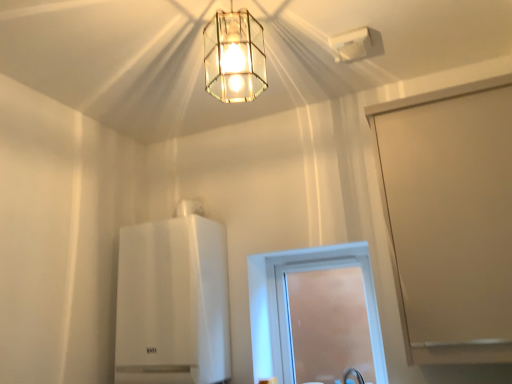
In order to face white glossy boiler at center, should I rotate leftwards or rightwards?

Turn left by 11.177 degrees to look at white glossy boiler at center.

Find the location of a particular element. The height and width of the screenshot is (384, 512). clear glass window at center is located at coordinates (287, 305).

This screenshot has height=384, width=512. What do you see at coordinates (287, 305) in the screenshot?
I see `clear glass window at center` at bounding box center [287, 305].

Identify the location of white glossy boiler at center. The height and width of the screenshot is (384, 512). (173, 303).

From the picture: Can you confirm if white glossy boiler at center is smaller than white plastic air vent at upper center, arranged as the 2th lamp when viewed from the left?

No, white glossy boiler at center is not smaller than white plastic air vent at upper center, arranged as the 2th lamp when viewed from the left.

In terms of width, does white glossy boiler at center look wider or thinner when compared to white plastic air vent at upper center, which is the first lamp from back to front?

Considering their sizes, white glossy boiler at center looks broader than white plastic air vent at upper center, which is the first lamp from back to front.

Is the surface of white glossy boiler at center in direct contact with white plastic air vent at upper center, which is the first lamp from back to front?

No, white glossy boiler at center is not in contact with white plastic air vent at upper center, which is the first lamp from back to front.

Does white glossy boiler at center contain white plastic air vent at upper center, placed as the 1th lamp when sorted from right to left?

No, white plastic air vent at upper center, placed as the 1th lamp when sorted from right to left, is not surrounded by white glossy boiler at center.

Considering the positions of objects beige matte screen door at right and clear glass pendant light at upper center, which is the 2th lamp in back-to-front order, in the image provided, who is behind, beige matte screen door at right or clear glass pendant light at upper center, which is the 2th lamp in back-to-front order,?

beige matte screen door at right is further away from the camera.

Is beige matte screen door at right positioned far away from clear glass pendant light at upper center, placed as the 2th lamp when sorted from right to left?

beige matte screen door at right is actually quite close to clear glass pendant light at upper center, placed as the 2th lamp when sorted from right to left.

Is beige matte screen door at right positioned beyond the bounds of clear glass pendant light at upper center, placed as the 2th lamp when sorted from right to left?

Yes.

From a real-world perspective, is beige matte screen door at right below clear glass pendant light at upper center, which is the first lamp in front-to-back order?

Yes, from a real-world perspective, beige matte screen door at right is beneath clear glass pendant light at upper center, which is the first lamp in front-to-back order.

Relative to clear glass pendant light at upper center, placed as the first lamp when sorted from left to right, is white glossy boiler at center in front or behind?

Clearly, white glossy boiler at center is behind clear glass pendant light at upper center, placed as the first lamp when sorted from left to right.

Considering the relative sizes of white glossy boiler at center and clear glass pendant light at upper center, which is the 2th lamp in back-to-front order, in the image provided, is white glossy boiler at center thinner than clear glass pendant light at upper center, which is the 2th lamp in back-to-front order,?

In fact, white glossy boiler at center might be wider than clear glass pendant light at upper center, which is the 2th lamp in back-to-front order.

Consider the image. Is clear glass pendant light at upper center, which is the first lamp in front-to-back order, located within white glossy boiler at center?

No, white glossy boiler at center does not contain clear glass pendant light at upper center, which is the first lamp in front-to-back order.

Is white glossy boiler at center positioned with its back to clear glass pendant light at upper center, which is the 2th lamp in back-to-front order?

No, white glossy boiler at center's orientation is not away from clear glass pendant light at upper center, which is the 2th lamp in back-to-front order.

How many degrees apart are the facing directions of clear glass pendant light at upper center, placed as the first lamp when sorted from left to right, and white plastic air vent at upper center, which is the first lamp from back to front?

The angular difference between clear glass pendant light at upper center, placed as the first lamp when sorted from left to right, and white plastic air vent at upper center, which is the first lamp from back to front, is 6.69 degrees.

Can you confirm if clear glass pendant light at upper center, placed as the 2th lamp when sorted from right to left, is positioned to the left of white plastic air vent at upper center, arranged as the 2th lamp when viewed from the left?

Indeed, clear glass pendant light at upper center, placed as the 2th lamp when sorted from right to left, is positioned on the left side of white plastic air vent at upper center, arranged as the 2th lamp when viewed from the left.

From the image's perspective, relative to white plastic air vent at upper center, which is the first lamp from back to front, is clear glass pendant light at upper center, placed as the first lamp when sorted from left to right, above or below?

Based on their image positions, clear glass pendant light at upper center, placed as the first lamp when sorted from left to right, is located beneath white plastic air vent at upper center, which is the first lamp from back to front.

Considering the sizes of objects clear glass pendant light at upper center, placed as the first lamp when sorted from left to right, and white plastic air vent at upper center, placed as the 1th lamp when sorted from right to left, in the image provided, who is smaller, clear glass pendant light at upper center, placed as the first lamp when sorted from left to right, or white plastic air vent at upper center, placed as the 1th lamp when sorted from right to left,?

Smaller between the two is white plastic air vent at upper center, placed as the 1th lamp when sorted from right to left.

In the scene shown: Does beige matte screen door at right come behind white plastic air vent at upper center, placed as the 1th lamp when sorted from right to left?

That is False.

Can you tell me how much beige matte screen door at right and white plastic air vent at upper center, which is the first lamp from back to front, differ in facing direction?

They differ by 1.06 degrees in their facing directions.

Is beige matte screen door at right with white plastic air vent at upper center, placed as the second lamp when sorted from front to back?

No, beige matte screen door at right is not with white plastic air vent at upper center, placed as the second lamp when sorted from front to back.

Is beige matte screen door at right thinner than white plastic air vent at upper center, which is the first lamp from back to front?

No, beige matte screen door at right is not thinner than white plastic air vent at upper center, which is the first lamp from back to front.

Is clear glass window at center looking in the opposite direction of white plastic air vent at upper center, arranged as the 2th lamp when viewed from the left?

clear glass window at center is not turned away from white plastic air vent at upper center, arranged as the 2th lamp when viewed from the left.

From a real-world perspective, who is located higher, clear glass window at center or white plastic air vent at upper center, arranged as the 2th lamp when viewed from the left?

white plastic air vent at upper center, arranged as the 2th lamp when viewed from the left, from a real-world perspective.

Is clear glass window at center in front of or behind white plastic air vent at upper center, placed as the 1th lamp when sorted from right to left, in the image?

In the image, clear glass window at center appears behind white plastic air vent at upper center, placed as the 1th lamp when sorted from right to left.

Is white plastic air vent at upper center, placed as the 1th lamp when sorted from right to left, completely or partially inside clear glass window at center?

No, white plastic air vent at upper center, placed as the 1th lamp when sorted from right to left, is not surrounded by clear glass window at center.

From the image's perspective, between white plastic air vent at upper center, arranged as the 2th lamp when viewed from the left, and white glossy boiler at center, which one is located above?

white plastic air vent at upper center, arranged as the 2th lamp when viewed from the left.

Consider the image. Are white plastic air vent at upper center, placed as the second lamp when sorted from front to back, and white glossy boiler at center far apart?

white plastic air vent at upper center, placed as the second lamp when sorted from front to back, is far away from white glossy boiler at center.

Is white plastic air vent at upper center, placed as the second lamp when sorted from front to back, positioned behind white glossy boiler at center?

No, white plastic air vent at upper center, placed as the second lamp when sorted from front to back, is closer to the camera.

Looking at their sizes, would you say white plastic air vent at upper center, arranged as the 2th lamp when viewed from the left, is wider or thinner than white glossy boiler at center?

white plastic air vent at upper center, arranged as the 2th lamp when viewed from the left, is thinner than white glossy boiler at center.

This screenshot has height=384, width=512. What are the coordinates of `appliance to the left of white plastic air vent at upper center, placed as the second lamp when sorted from front to back` in the screenshot? It's located at tap(173, 303).

You are a GUI agent. You are given a task and a screenshot of the screen. Output one action in this format:
    pyautogui.click(x=<x>, y=<y>)
    Task: Click on the screen door below the clear glass pendant light at upper center, which is the 2th lamp in back-to-front order (from a real-world perspective)
    
    Given the screenshot: What is the action you would take?
    pyautogui.click(x=450, y=218)

Which object lies nearer to the anchor point clear glass window at center, clear glass pendant light at upper center, which is the first lamp in front-to-back order, or white plastic air vent at upper center, placed as the second lamp when sorted from front to back?

Among the two, clear glass pendant light at upper center, which is the first lamp in front-to-back order, is located nearer to clear glass window at center.

Which object lies nearer to the anchor point white glossy boiler at center, clear glass pendant light at upper center, which is the first lamp in front-to-back order, or clear glass window at center?

clear glass window at center is closer to white glossy boiler at center.

Looking at the image, which one is located closer to white plastic air vent at upper center, which is the first lamp from back to front, white glossy boiler at center or clear glass window at center?

clear glass window at center lies closer to white plastic air vent at upper center, which is the first lamp from back to front, than the other object.

Looking at the image, which one is located further to beige matte screen door at right, white glossy boiler at center or clear glass window at center?

The object further to beige matte screen door at right is white glossy boiler at center.

Which object lies further to the anchor point clear glass window at center, white glossy boiler at center or white plastic air vent at upper center, placed as the second lamp when sorted from front to back?

Answer: white plastic air vent at upper center, placed as the second lamp when sorted from front to back, is positioned further to the anchor clear glass window at center.

From the image, which object appears to be farther from white plastic air vent at upper center, placed as the second lamp when sorted from front to back, clear glass pendant light at upper center, which is the first lamp in front-to-back order, or white glossy boiler at center?

white glossy boiler at center is positioned further to the anchor white plastic air vent at upper center, placed as the second lamp when sorted from front to back.

Which object lies nearer to the anchor point clear glass window at center, clear glass pendant light at upper center, which is the first lamp in front-to-back order, or white glossy boiler at center?

The object closer to clear glass window at center is white glossy boiler at center.

Considering their positions, is clear glass window at center positioned closer to white plastic air vent at upper center, arranged as the 2th lamp when viewed from the left, than beige matte screen door at right?

beige matte screen door at right.

At what (x,y) coordinates should I click in order to perform the action: click on screen door between clear glass pendant light at upper center, placed as the first lamp when sorted from left to right, and clear glass window at center vertically. Please return your answer as a coordinate pair (x, y). Looking at the image, I should click on (450, 218).

At what (x,y) coordinates should I click in order to perform the action: click on lamp between clear glass pendant light at upper center, placed as the first lamp when sorted from left to right, and beige matte screen door at right. Please return your answer as a coordinate pair (x, y). Looking at the image, I should click on (351, 45).

Locate an element on the screen. Image resolution: width=512 pixels, height=384 pixels. appliance between white plastic air vent at upper center, placed as the second lamp when sorted from front to back, and clear glass window at center vertically is located at coordinates (173, 303).

Locate an element on the screen. screen door between white plastic air vent at upper center, which is the first lamp from back to front, and clear glass window at center from top to bottom is located at coordinates (450, 218).